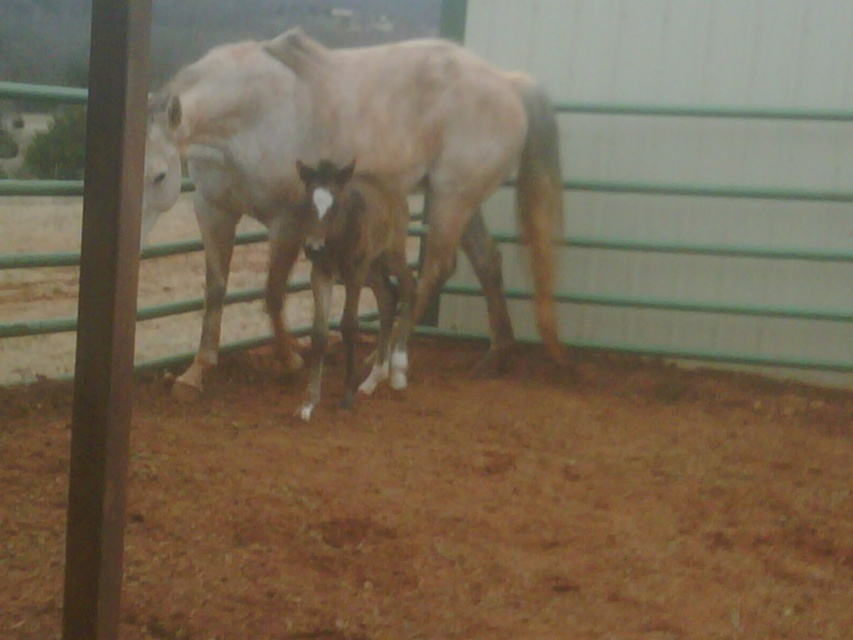
Question: Among these points, which one is farthest from the camera?

Choices:
 (A) (352, 232)
 (B) (485, 278)

Answer: (B)

Question: Does white matte horse at center appear on the left side of dark brown glossy horse at center?

Choices:
 (A) yes
 (B) no

Answer: (B)

Question: From the image, what is the correct spatial relationship of white matte horse at center in relation to dark brown glossy horse at center?

Choices:
 (A) above
 (B) below

Answer: (A)

Question: Can you confirm if white matte horse at center is bigger than dark brown glossy horse at center?

Choices:
 (A) yes
 (B) no

Answer: (A)